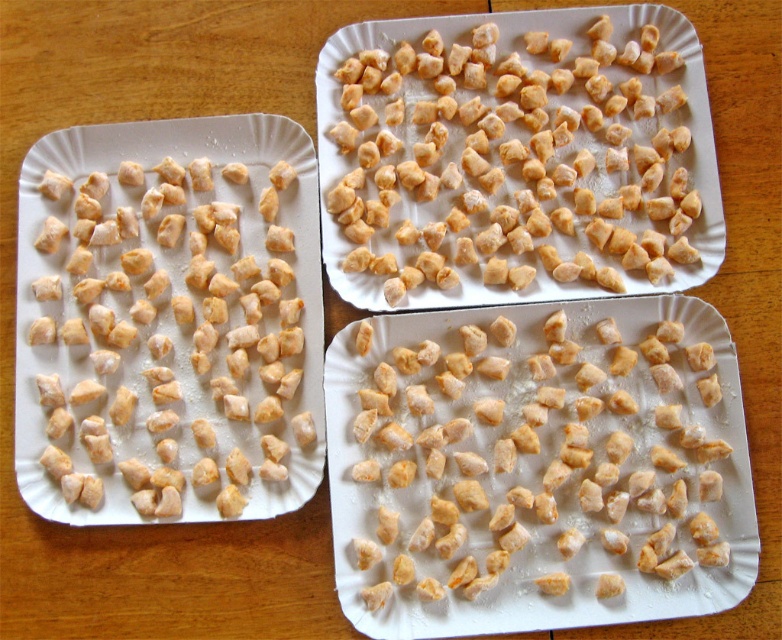
Question: Where is golden brown crumbly at center located in relation to golden brown croutons at center in the image?

Choices:
 (A) right
 (B) left

Answer: (A)

Question: Among these objects, which one is nearest to the camera?

Choices:
 (A) golden brown croutons at center
 (B) light brown dough at left

Answer: (B)

Question: Is golden brown crumbly at center to the left of golden brown croutons at center from the viewer's perspective?

Choices:
 (A) no
 (B) yes

Answer: (A)

Question: Is golden brown crumbly at center below golden brown croutons at center?

Choices:
 (A) yes
 (B) no

Answer: (A)

Question: Which of these objects is positioned closest to the golden brown croutons at center?

Choices:
 (A) light brown dough at left
 (B) golden brown crumbly at center

Answer: (B)

Question: Which object appears farthest from the camera in this image?

Choices:
 (A) golden brown crumbly at center
 (B) golden brown croutons at center
 (C) light brown dough at left

Answer: (B)